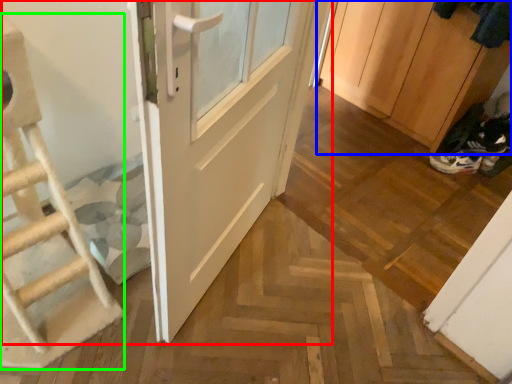
Question: Considering the real-world distances, which object is farthest from door (highlighted by a red box)? cabinetry (highlighted by a blue box) or ladder (highlighted by a green box)?

Choices:
 (A) cabinetry
 (B) ladder

Answer: (A)